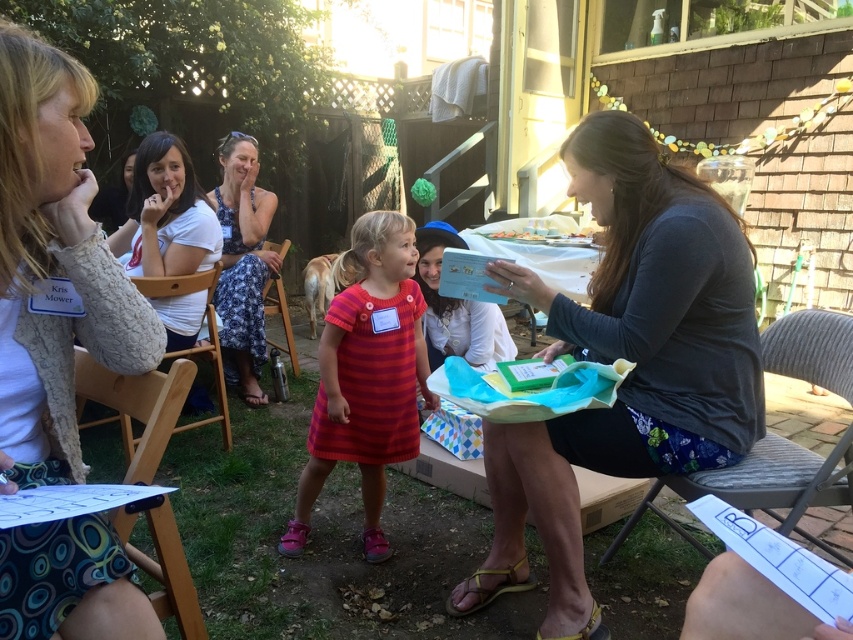
Question: Can you confirm if blue floral dress at center is bigger than metallic silver chair at center?

Choices:
 (A) yes
 (B) no

Answer: (A)

Question: Which object appears farthest from the camera in this image?

Choices:
 (A) white matte shirt at upper left
 (B) gray fabric chair at lower right
 (C) wooden chair at center
 (D) striped cotton dress at center

Answer: (A)

Question: Which point is closer to the camera?

Choices:
 (A) smooth plastic plate at center
 (B) gray fabric shirt at center

Answer: (B)

Question: Does striped cotton dress at center have a larger size compared to smooth plastic plate at center?

Choices:
 (A) yes
 (B) no

Answer: (A)

Question: Considering the real-world distances, which object is farthest from the gray fabric shirt at center?

Choices:
 (A) white matte shirt at upper left
 (B) metallic silver chair at center

Answer: (B)

Question: Is white textured cardigan at upper left bigger than striped cotton dress at center?

Choices:
 (A) no
 (B) yes

Answer: (A)